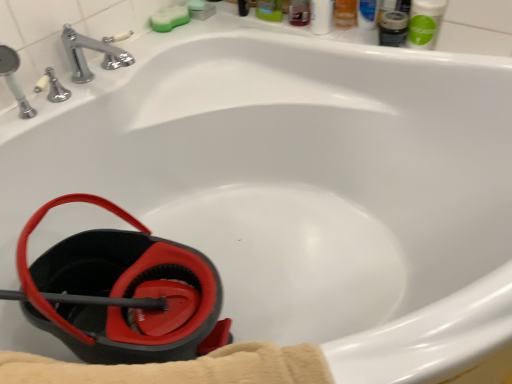
Question: In terms of height, does green matte mouthwash at upper right, which is the 2th mouthwash in left-to-right order, look taller or shorter compared to matte black mouthwash at upper right, which appears as the second mouthwash when viewed from the right?

Choices:
 (A) tall
 (B) short

Answer: (A)

Question: From a real-world perspective, is green matte mouthwash at upper right, the first mouthwash positioned from the right, above or below matte black mouthwash at upper right, which appears as the second mouthwash when viewed from the right?

Choices:
 (A) below
 (B) above

Answer: (B)

Question: Which is nearer to the black rubber bucket at lower left?

Choices:
 (A) green sponge at upper center
 (B) matte black mouthwash at upper right, which appears as the second mouthwash when viewed from the right
 (C) green matte mouthwash at upper right, which is the 2th mouthwash in left-to-right order

Answer: (A)

Question: Estimate the real-world distances between objects in this image. Which object is farther from the green matte mouthwash at upper right, which is the 2th mouthwash in left-to-right order?

Choices:
 (A) black rubber bucket at lower left
 (B) matte black mouthwash at upper right, which appears as the first mouthwash when viewed from the left
 (C) green sponge at upper center

Answer: (A)